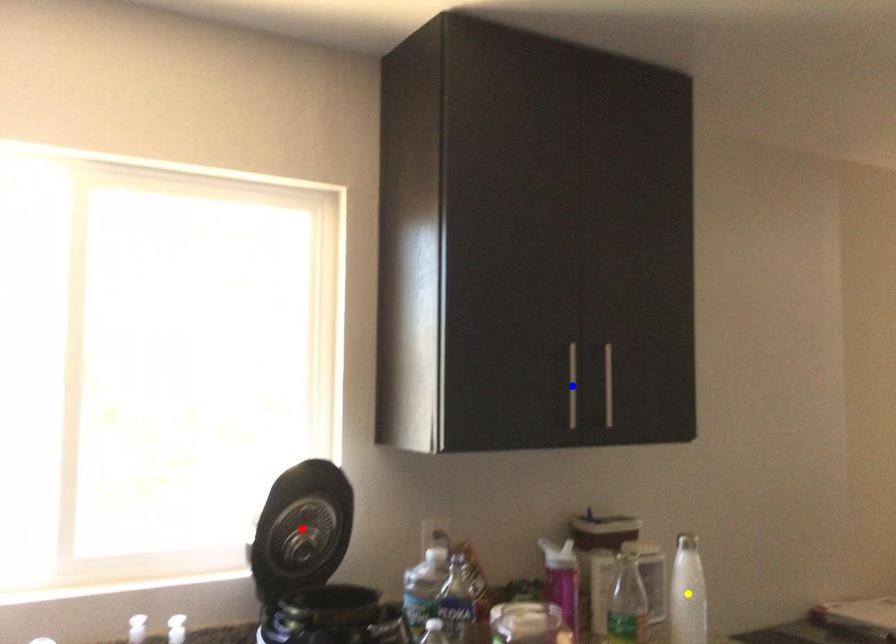
Order these from nearest to farthest:
A) red point
B) blue point
C) yellow point

red point, blue point, yellow point